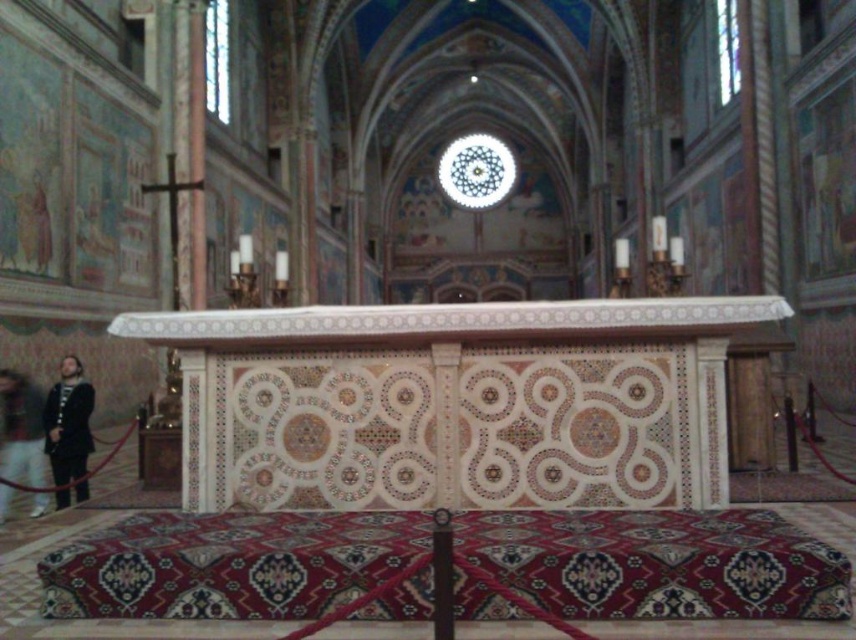
Who is lower down, dark brown leather jacket at lower left or light brown leather jacket at lower left?

dark brown leather jacket at lower left is below.

Is point (86, 380) closer to camera compared to point (12, 477)?

That is False.

Find the location of a particular element. The height and width of the screenshot is (640, 856). dark brown leather jacket at lower left is located at coordinates (69, 426).